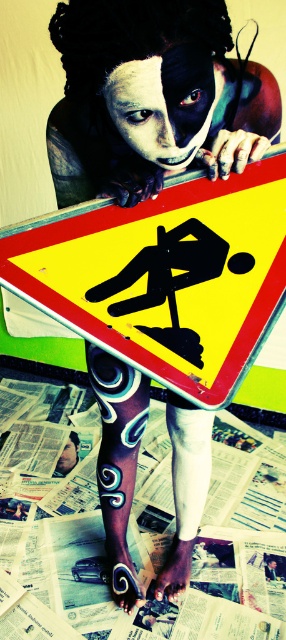
Does yellow paper at center have a larger size compared to black matte face at center?

Indeed, yellow paper at center has a larger size compared to black matte face at center.

Which is more to the left, yellow paper at center or black matte face at center?

black matte face at center is more to the left.

Identify the location of yellow paper at center. The height and width of the screenshot is (640, 286). (66, 572).

Does black matte face at center have a lesser height compared to white matte skin at lower left?

In fact, black matte face at center may be taller than white matte skin at lower left.

Can you confirm if black matte face at center is positioned to the left of white matte skin at lower left?

No, black matte face at center is not to the left of white matte skin at lower left.

You are a GUI agent. You are given a task and a screenshot of the screen. Output one action in this format:
    pyautogui.click(x=<x>, y=<y>)
    Task: Click on the black matte face at center
    This screenshot has height=640, width=286.
    Given the screenshot: What is the action you would take?
    pyautogui.click(x=147, y=113)

Is yellow reflective plastic at center closer to camera compared to yellow paper at center?

Yes, yellow reflective plastic at center is closer to the viewer.

Who is more forward, (x=120, y=259) or (x=70, y=524)?

Point (x=120, y=259)

At what (x,y) coordinates should I click in order to perform the action: click on yellow reflective plastic at center. Please return your answer as a coordinate pair (x, y). The width and height of the screenshot is (286, 640). Looking at the image, I should click on pyautogui.click(x=165, y=275).